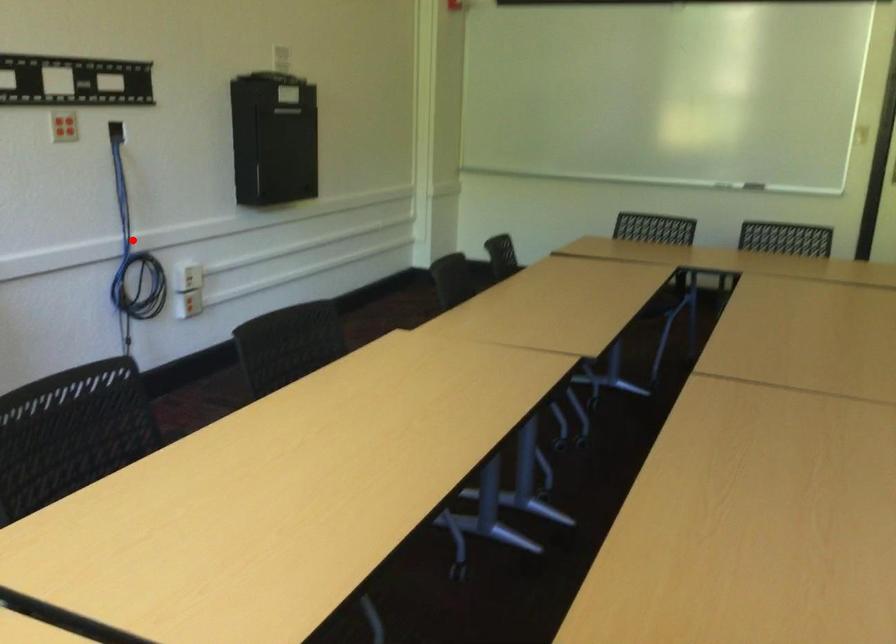
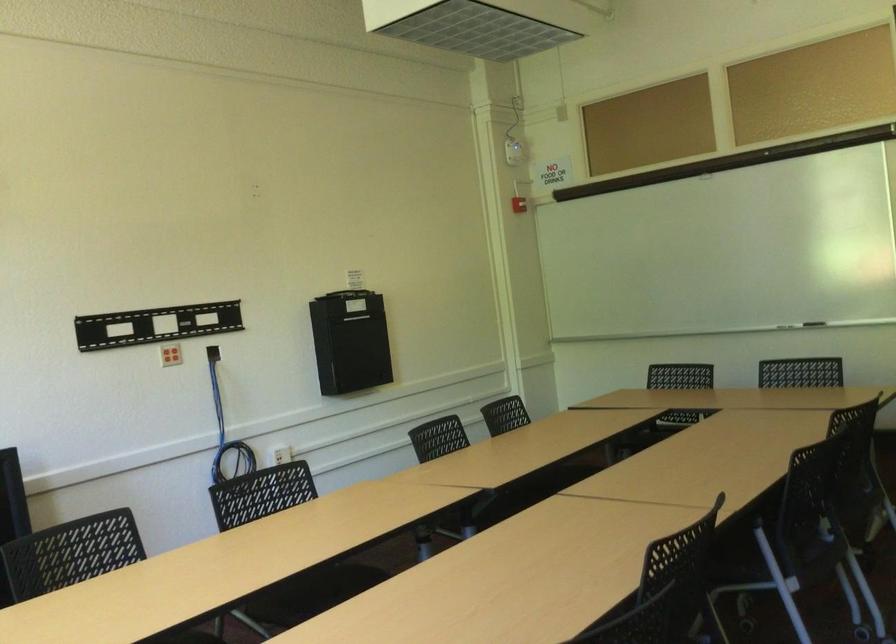
Question: I am providing you with two images of the same scene from different viewpoints. A red point is shown in image1. For the corresponding object point in image2, is it positioned nearer or farther from the camera?

Choices:
 (A) Nearer
 (B) Farther

Answer: (B)